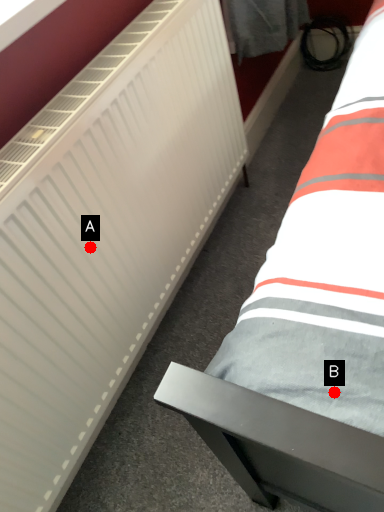
Question: Two points are circled on the image, labeled by A and B beside each circle. Which point is farther from the camera taking this photo?

Choices:
 (A) A is further
 (B) B is further

Answer: (A)